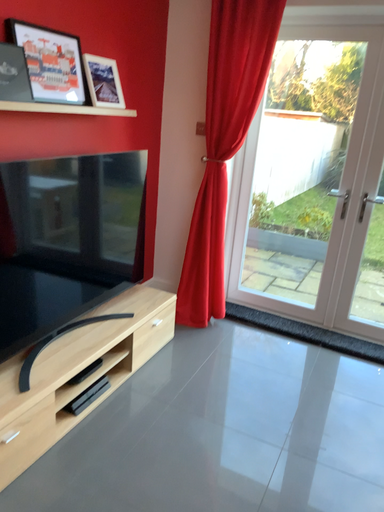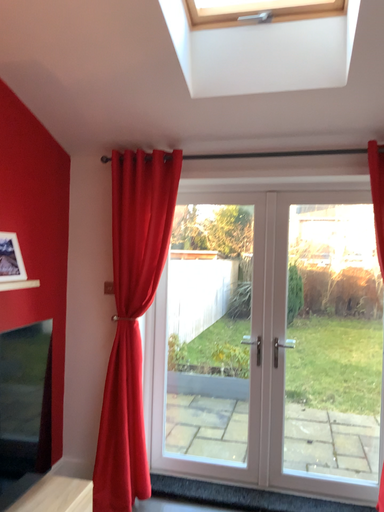
Question: How did the camera likely rotate when shooting the video?

Choices:
 (A) rotated upward
 (B) rotated downward

Answer: (A)